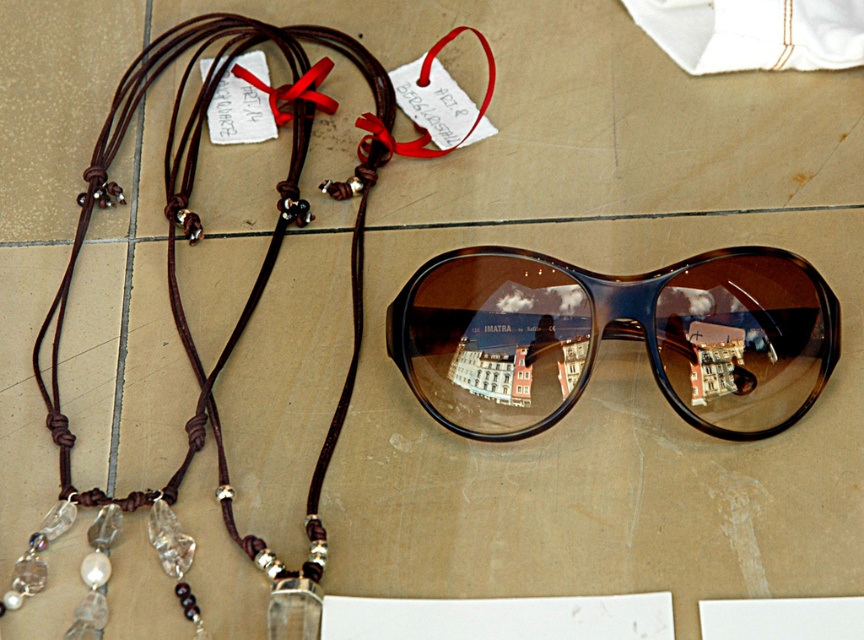
Which is above, brown tortoiseshell sunglasses at center or brown leather necklace at left?

brown leather necklace at left is above.

Is brown tortoiseshell sunglasses at center wider than brown leather necklace at left?

Incorrect, brown tortoiseshell sunglasses at center's width does not surpass brown leather necklace at left's.

Is point (446, 310) positioned before point (227, 356)?

Yes, point (446, 310) is in front of point (227, 356).

This screenshot has width=864, height=640. I want to click on brown tortoiseshell sunglasses at center, so click(x=614, y=337).